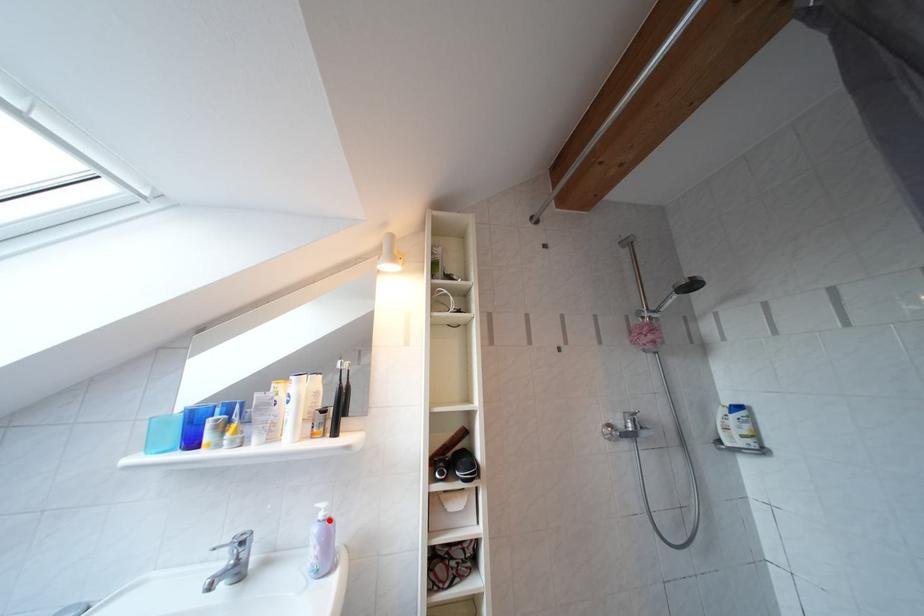
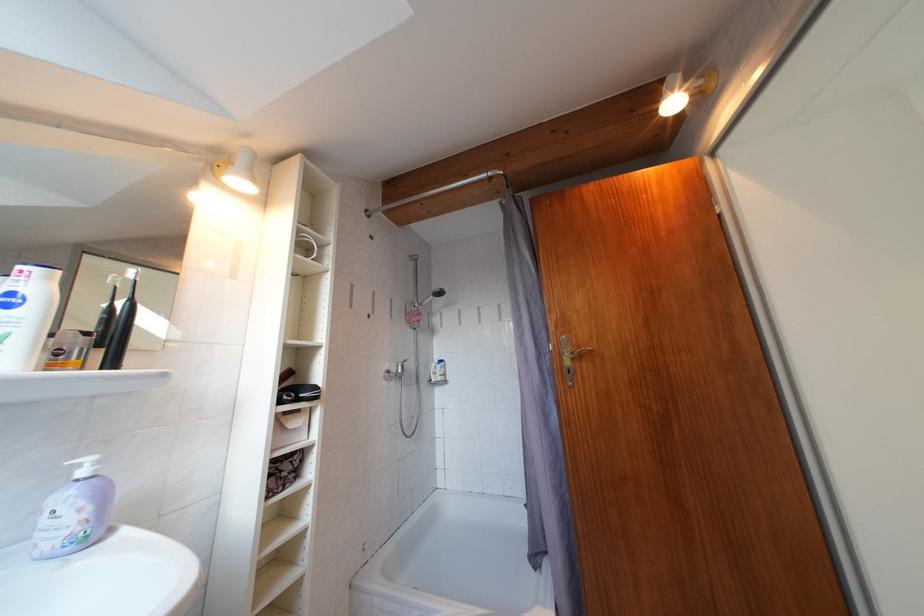
The point at the highlighted location is marked in the first image. Where is the corresponding point in the second image?

(92, 477)